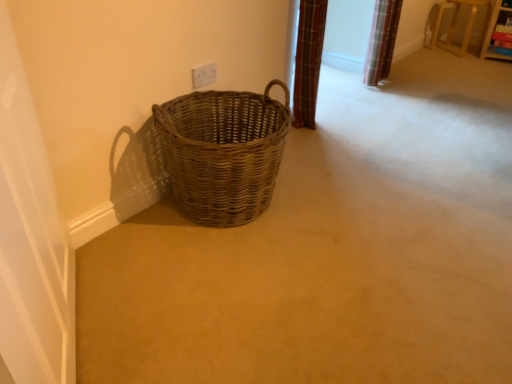
Question: Is woven brown basket at lower left wider than white plastic electric outlet at upper center?

Choices:
 (A) yes
 (B) no

Answer: (A)

Question: Considering the relative positions of woven brown basket at lower left and white plastic electric outlet at upper center in the image provided, is woven brown basket at lower left to the right of white plastic electric outlet at upper center from the viewer's perspective?

Choices:
 (A) yes
 (B) no

Answer: (A)

Question: Can you confirm if woven brown basket at lower left is smaller than white plastic electric outlet at upper center?

Choices:
 (A) no
 (B) yes

Answer: (A)

Question: From the image's perspective, is woven brown basket at lower left under white plastic electric outlet at upper center?

Choices:
 (A) no
 (B) yes

Answer: (B)

Question: Can you confirm if woven brown basket at lower left is bigger than white plastic electric outlet at upper center?

Choices:
 (A) yes
 (B) no

Answer: (A)

Question: Considering the positions of white plastic electric outlet at upper center and white glossy screen door at left in the image, is white plastic electric outlet at upper center taller or shorter than white glossy screen door at left?

Choices:
 (A) tall
 (B) short

Answer: (B)

Question: From the image's perspective, is white plastic electric outlet at upper center above or below white glossy screen door at left?

Choices:
 (A) above
 (B) below

Answer: (A)

Question: From a real-world perspective, is white plastic electric outlet at upper center physically located above or below white glossy screen door at left?

Choices:
 (A) above
 (B) below

Answer: (B)

Question: Which is correct: white plastic electric outlet at upper center is inside white glossy screen door at left, or outside of it?

Choices:
 (A) outside
 (B) inside

Answer: (A)

Question: Considering the positions of white glossy screen door at left and woven brown basket at lower left in the image, is white glossy screen door at left bigger or smaller than woven brown basket at lower left?

Choices:
 (A) big
 (B) small

Answer: (B)

Question: Is white glossy screen door at left to the left or to the right of woven brown basket at lower left in the image?

Choices:
 (A) left
 (B) right

Answer: (A)

Question: Is white glossy screen door at left situated inside woven brown basket at lower left or outside?

Choices:
 (A) inside
 (B) outside

Answer: (B)

Question: From their relative heights in the image, would you say white glossy screen door at left is taller or shorter than woven brown basket at lower left?

Choices:
 (A) tall
 (B) short

Answer: (A)

Question: Is white plastic electric outlet at upper center bigger or smaller than woven brown basket at lower left?

Choices:
 (A) small
 (B) big

Answer: (A)

Question: In the image, is white plastic electric outlet at upper center positioned in front of or behind woven brown basket at lower left?

Choices:
 (A) front
 (B) behind

Answer: (B)